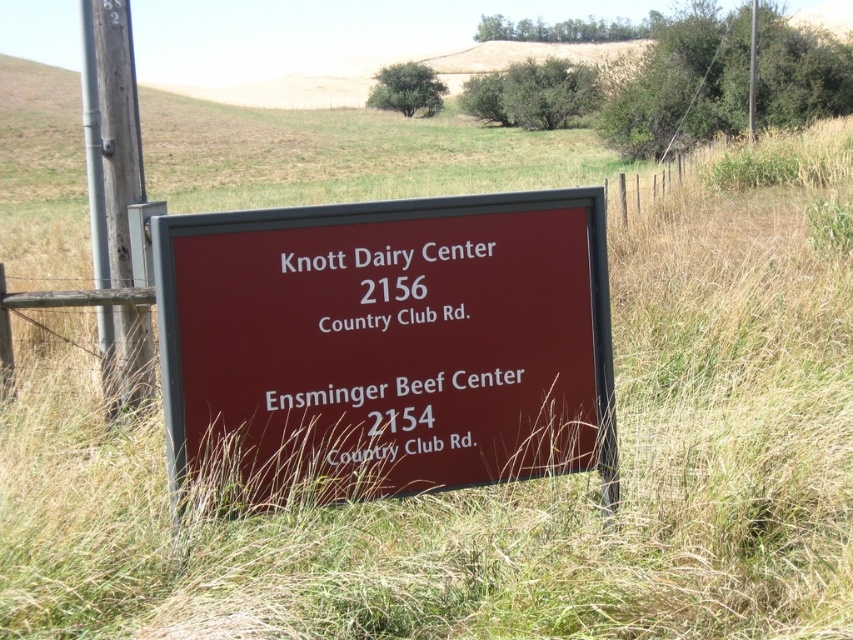
Question: Which object is the farthest from the gray metallic pole at left?

Choices:
 (A) maroon sign at center
 (B) maroon plastic sign at center

Answer: (A)

Question: Does maroon plastic sign at center appear on the left side of gray metallic pole at left?

Choices:
 (A) no
 (B) yes

Answer: (A)

Question: Can you confirm if maroon plastic sign at center is positioned below maroon sign at center?

Choices:
 (A) yes
 (B) no

Answer: (B)

Question: Which object appears closest to the camera in this image?

Choices:
 (A) maroon sign at center
 (B) gray metallic pole at left
 (C) maroon plastic sign at center

Answer: (C)

Question: Considering the real-world distances, which object is farthest from the maroon sign at center?

Choices:
 (A) gray metallic pole at left
 (B) maroon plastic sign at center

Answer: (A)

Question: Can you confirm if maroon plastic sign at center is smaller than gray metallic pole at left?

Choices:
 (A) yes
 (B) no

Answer: (A)